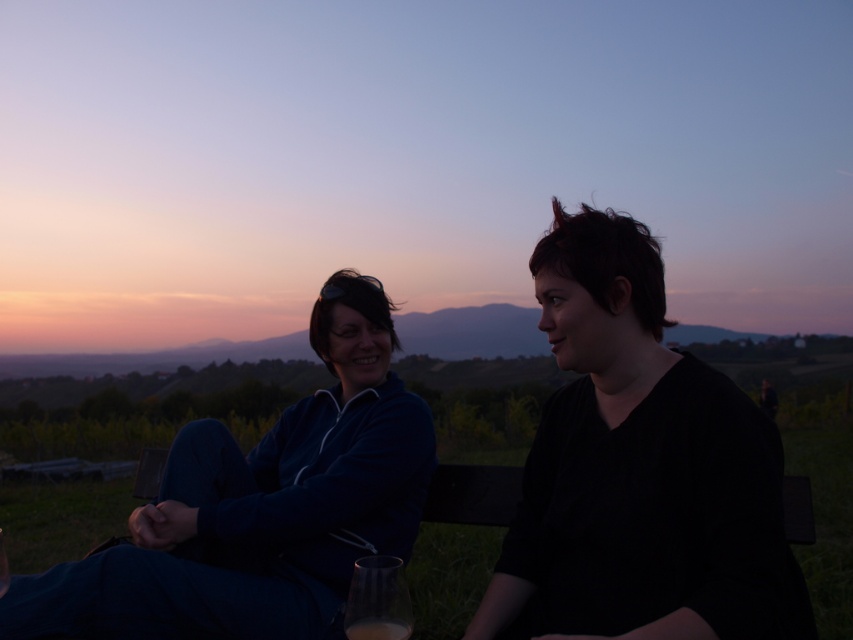
Question: Which point is closer to the camera?

Choices:
 (A) (375, 285)
 (B) (305, 419)
 (C) (729, 460)
 (D) (396, 637)

Answer: (D)

Question: Does black matte shirt at center appear on the right side of matte blue jacket at left?

Choices:
 (A) yes
 (B) no

Answer: (A)

Question: Observing the image, what is the correct spatial positioning of dark blue jacket at center in reference to translucent glass at lower center?

Choices:
 (A) right
 (B) left

Answer: (B)

Question: Which of the following is the farthest from the observer?

Choices:
 (A) (329, 323)
 (B) (355, 625)

Answer: (A)

Question: From the image, what is the correct spatial relationship of matte blue jacket at left in relation to translucent glass at lower center?

Choices:
 (A) below
 (B) above

Answer: (A)

Question: Which object is the closest to the translucent glass at lower center?

Choices:
 (A) dark blue jacket at center
 (B) black matte shirt at center
 (C) matte blue jacket at left

Answer: (B)